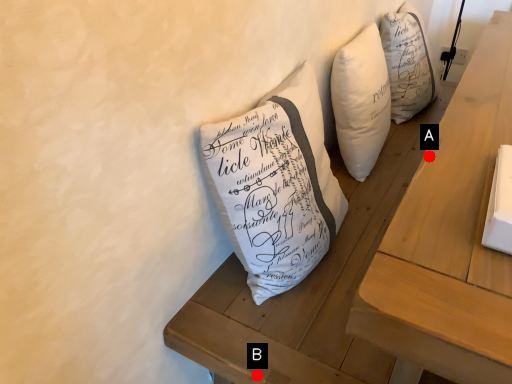
Question: Two points are circled on the image, labeled by A and B beside each circle. Which point is farther from the camera taking this photo?

Choices:
 (A) A is further
 (B) B is further

Answer: (B)